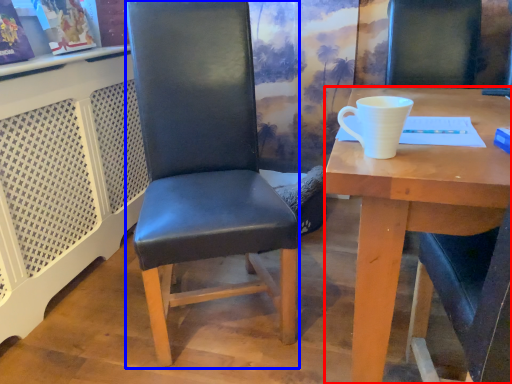
Question: Among these objects, which one is nearest to the camera, desk (highlighted by a red box) or chair (highlighted by a blue box)?

Choices:
 (A) desk
 (B) chair

Answer: (A)